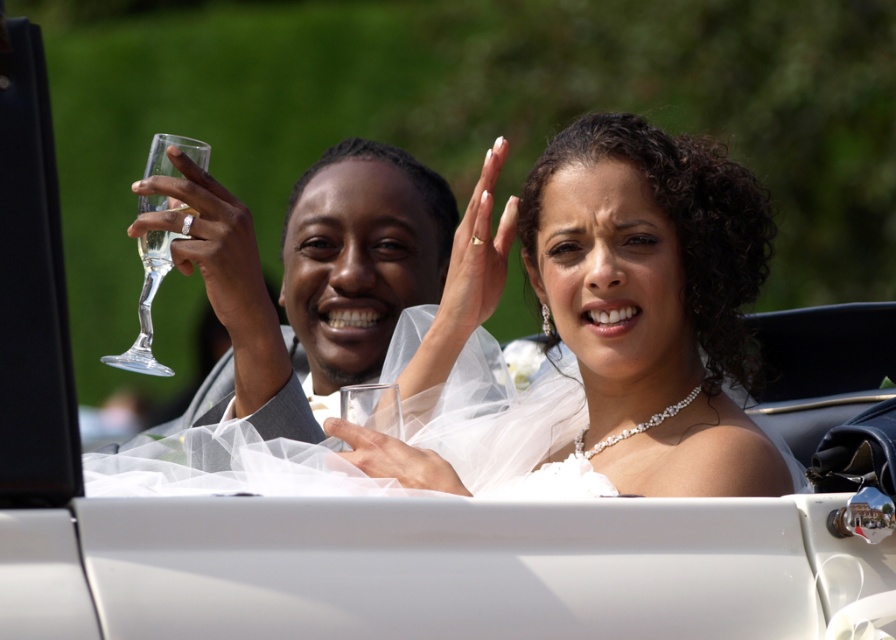
You are a photographer at a wedding. You need to capture a closeup shot of the pearl necklace at center and the clear glass flute at upper left. Which object will appear smaller in the photo?

The pearl necklace at center will appear smaller in the photo because it is thinner than the clear glass flute at upper left.

Looking at this image, you are a photographer at a wedding. You need to capture a closeup of the pearl necklace at center and the clear glass wine glass at upper left. Which object will appear larger in the photo?

The pearl necklace at center will appear larger in the photo because it is taller than the clear glass wine glass at upper left.